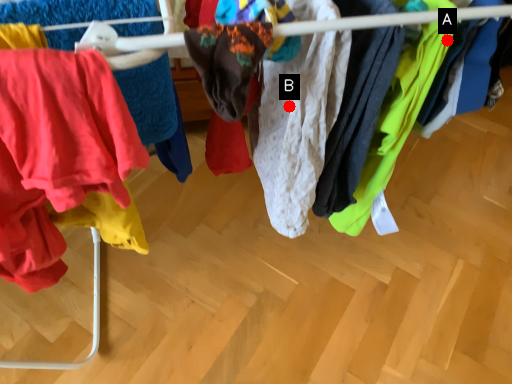
Question: Two points are circled on the image, labeled by A and B beside each circle. Which point is further to the camera?

Choices:
 (A) A is further
 (B) B is further

Answer: (B)